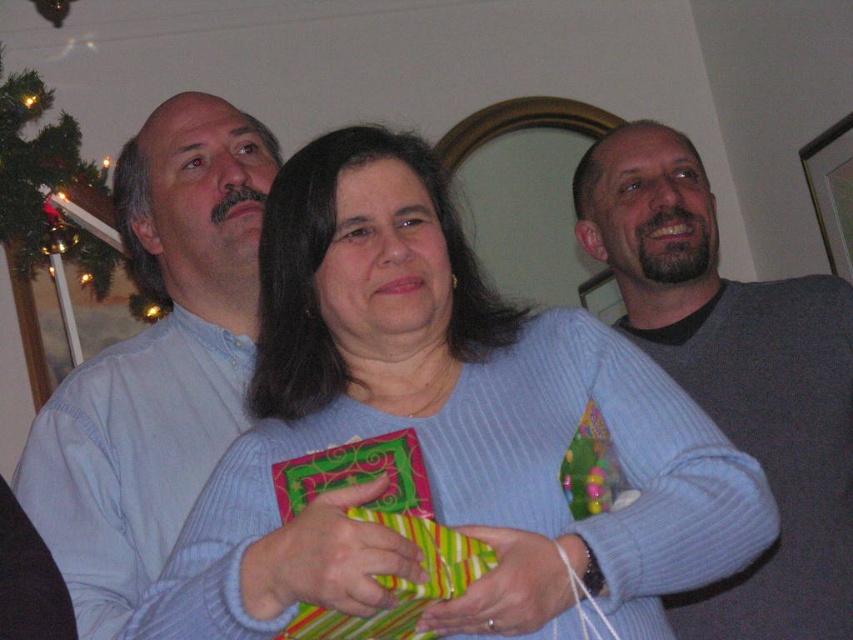
You are standing in a room where two people are wearing ribbed sweaters. The blue ribbed sweater at center and the gray ribbed sweater at upper right. Which sweater is closer to you?

The blue ribbed sweater at center is closer to the viewer than the gray ribbed sweater at upper right.

Please look at the scene and locate the point at coordinate (155, 362). What object is located at this point?

The light blue sweater at left is located at point (155, 362).

You are organizing a clothing rack and need to place the blue ribbed sweater at center and the light blue sweater at left according to their positions in the image. Which sweater should be placed to the right of the other?

The blue ribbed sweater at center should be placed to the right of the light blue sweater at left because in the image, the blue ribbed sweater at center is to the right of the light blue sweater at left.